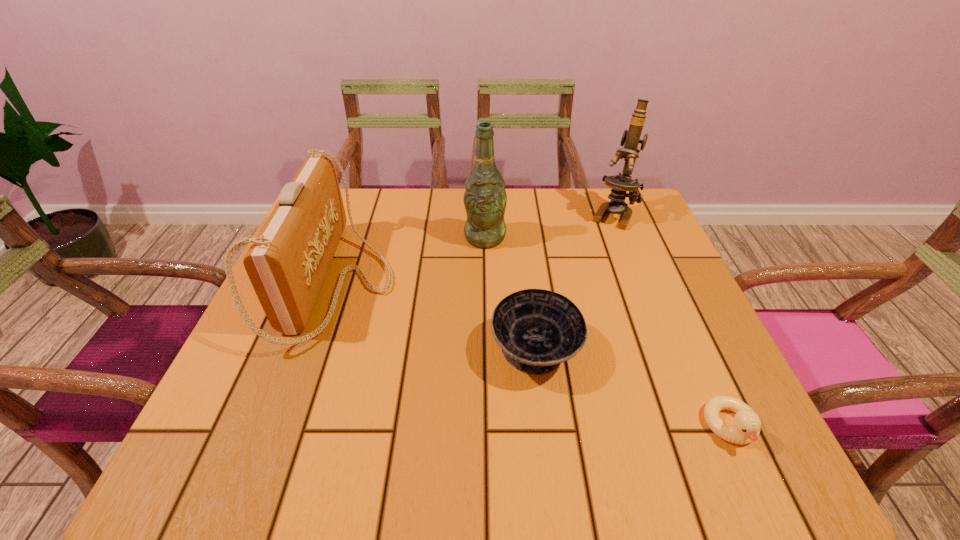
Where is `vacant space located 0.210m on the left of the bowl`? vacant space located 0.210m on the left of the bowl is located at coordinates (381, 352).

Image resolution: width=960 pixels, height=540 pixels. What are the coordinates of `microscope present at the far edge` in the screenshot? It's located at (621, 183).

Where is `beer bottle that is at the far edge`? Image resolution: width=960 pixels, height=540 pixels. beer bottle that is at the far edge is located at coordinates pyautogui.click(x=485, y=198).

Image resolution: width=960 pixels, height=540 pixels. In order to click on handbag at the far edge in this screenshot , I will do `click(287, 263)`.

In order to click on object that is at the near edge in this screenshot , I will do click(x=746, y=428).

Where is `object present at the left edge`? The image size is (960, 540). object present at the left edge is located at coordinates (287, 263).

I want to click on microscope at the right edge, so click(x=621, y=183).

Where is `duckling positioned at the right edge`? duckling positioned at the right edge is located at coordinates (746, 428).

I want to click on object that is at the far left corner, so click(x=287, y=263).

The width and height of the screenshot is (960, 540). What are the coordinates of `object situated at the far right corner` in the screenshot? It's located at (621, 183).